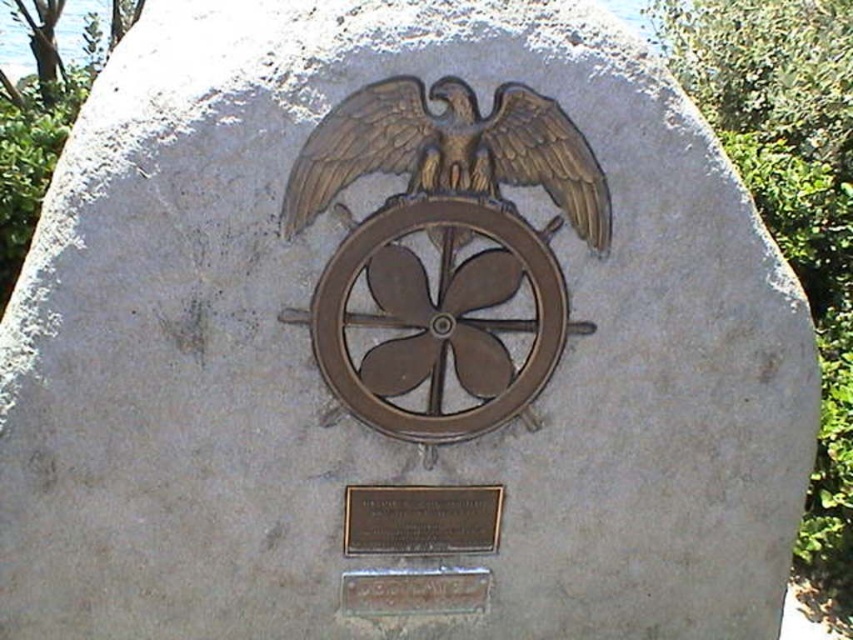
Question: Is gold polished metal eagle at center to the right of rusty metal plaque at lower center from the viewer's perspective?

Choices:
 (A) no
 (B) yes

Answer: (B)

Question: Which point appears closest to the camera in this image?

Choices:
 (A) (482, 385)
 (B) (463, 160)
 (C) (486, 588)
 (D) (491, 541)

Answer: (B)

Question: Which object appears farthest from the camera in this image?

Choices:
 (A) bronze plaque at lower center
 (B) bronze/textured eagle at center
 (C) gold polished metal eagle at center
 (D) rusty metal plaque at lower center

Answer: (D)

Question: In this image, where is gold polished metal eagle at center located relative to bronze plaque at lower center?

Choices:
 (A) right
 (B) left

Answer: (A)

Question: Which point is farther to the camera?

Choices:
 (A) (403, 298)
 (B) (426, 486)
 (C) (596, 243)
 (D) (457, 604)

Answer: (D)

Question: Does gold polished metal eagle at center appear on the left side of rusty metal plaque at lower center?

Choices:
 (A) yes
 (B) no

Answer: (B)